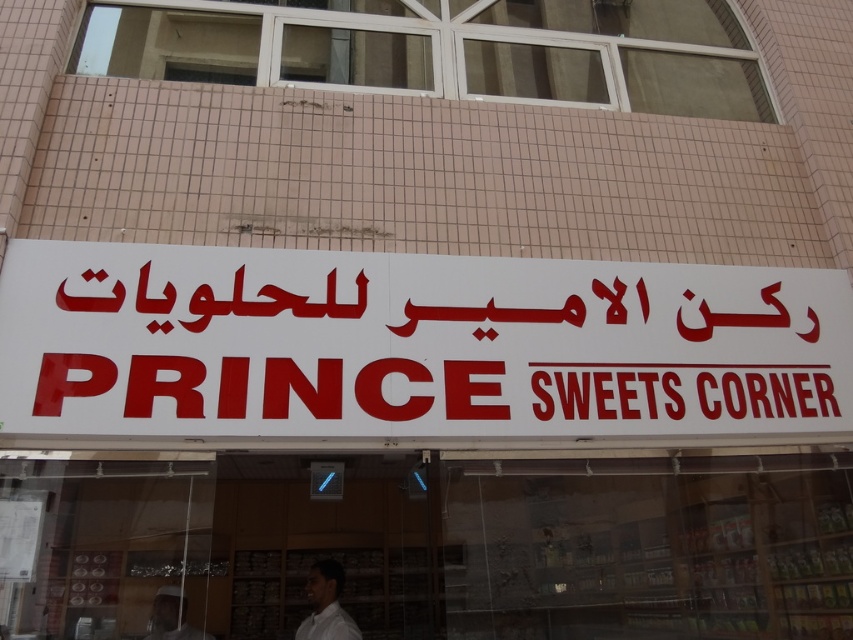
Question: Among these objects, which one is nearest to the camera?

Choices:
 (A) white matte signboard at center
 (B) white matte man at center
 (C) white matte shirt at lower center
 (D) transparent glass storefront at center

Answer: (A)

Question: Which point is closer to the camera?

Choices:
 (A) [x=335, y=582]
 (B) [x=434, y=396]
 (C) [x=433, y=520]
 (D) [x=180, y=630]

Answer: (B)

Question: Which point appears closest to the camera in this image?

Choices:
 (A) (115, 628)
 (B) (142, 257)

Answer: (B)

Question: Is white matte signboard at center closer to the viewer compared to white matte shirt at lower center?

Choices:
 (A) yes
 (B) no

Answer: (A)

Question: Is transparent glass storefront at center above white matte shirt at lower center?

Choices:
 (A) no
 (B) yes

Answer: (A)

Question: Is transparent glass storefront at center smaller than white matte shirt at lower center?

Choices:
 (A) no
 (B) yes

Answer: (A)